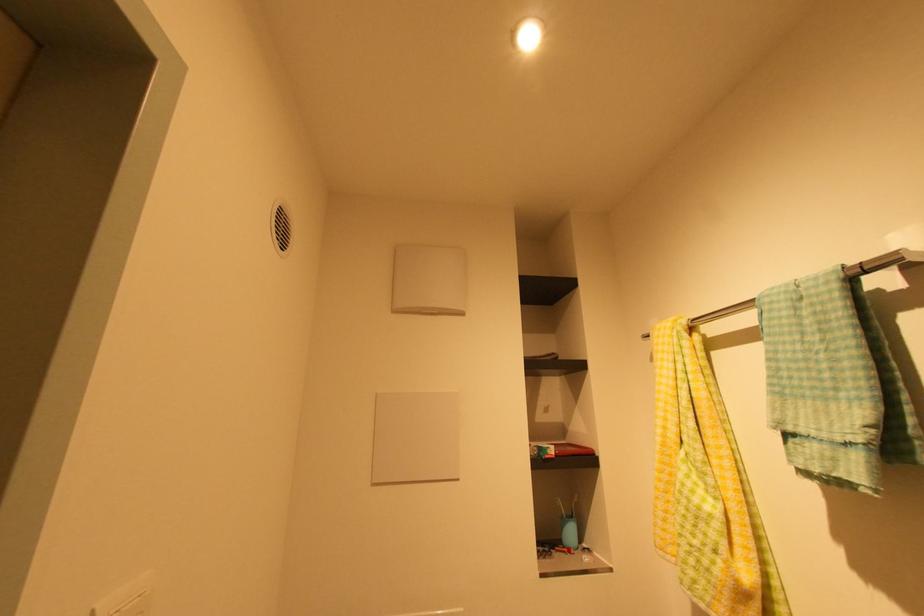
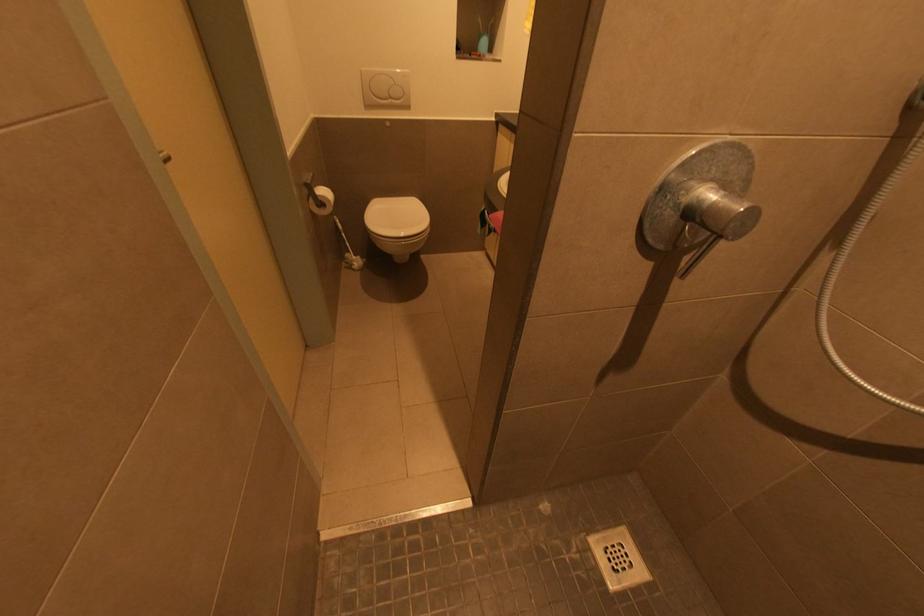
Question: Based on the continuous images, in which direction is the camera rotating? Reply with the corresponding letter.

Choices:
 (A) Left
 (B) Right
 (C) Up
 (D) Down

Answer: (D)